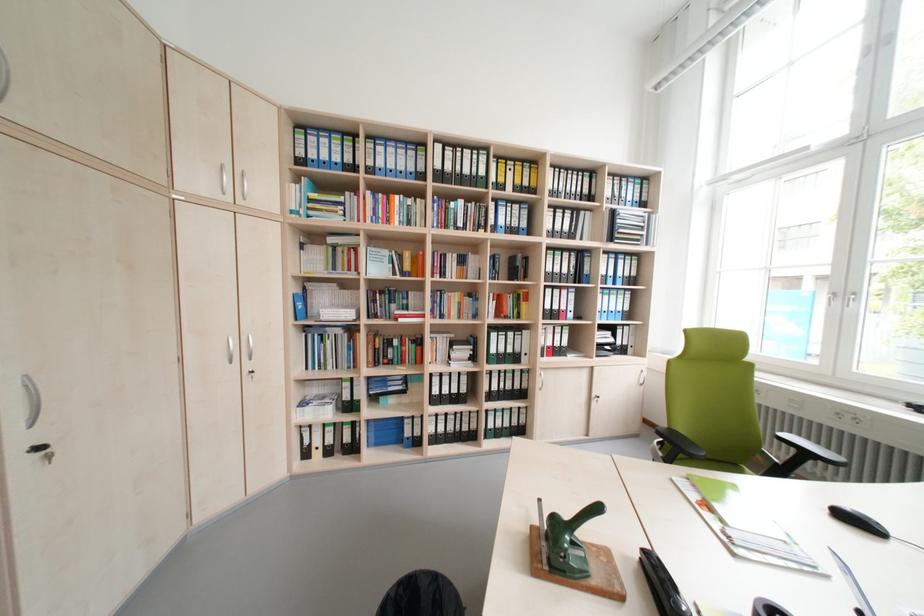
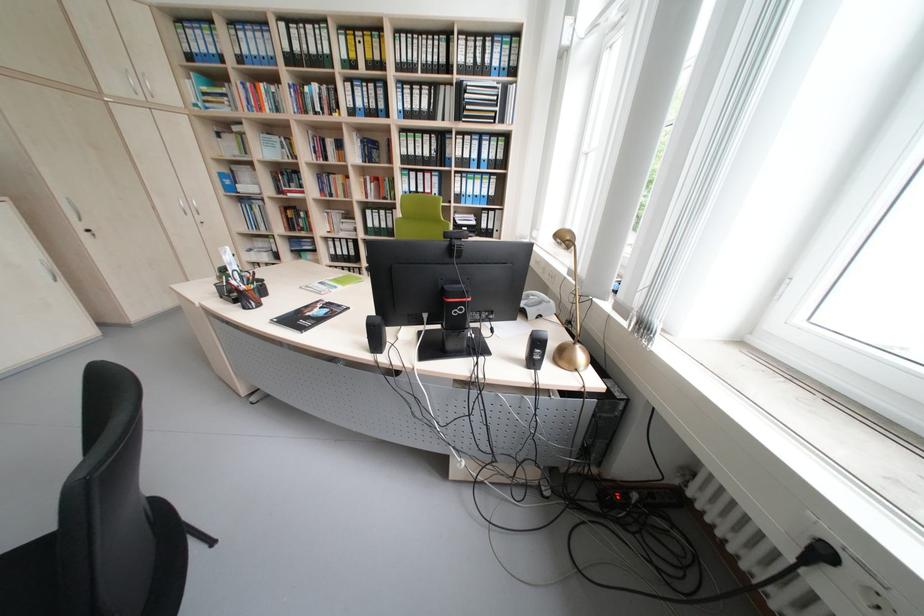
In the second image, find the point that corresponds to the point at 33,463 in the first image.

(93, 236)